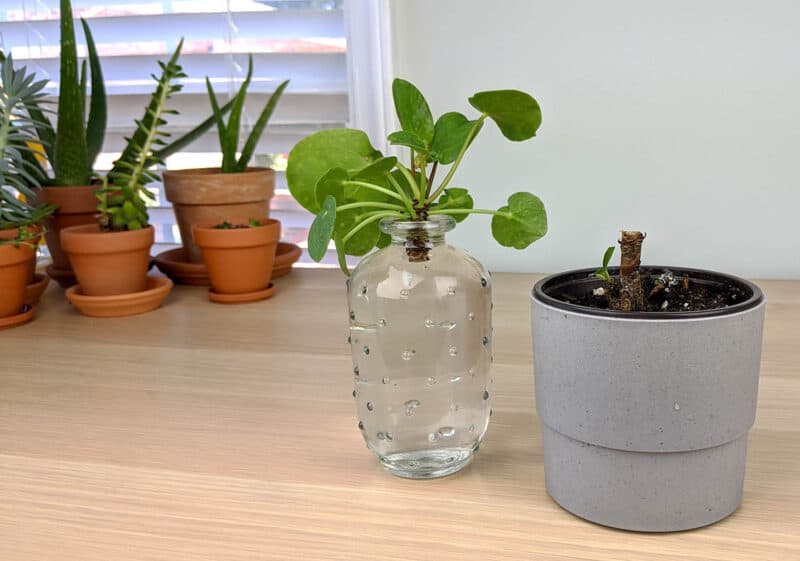
Where is `window`? The width and height of the screenshot is (800, 561). window is located at coordinates (286, 47).